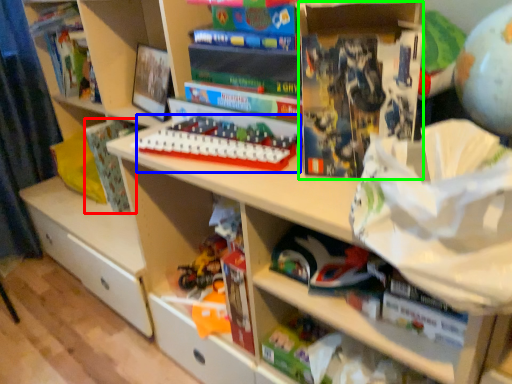
Question: Based on their relative distances, which object is farther from paperback book (highlighted by a red box)? Choose from toy (highlighted by a blue box) and paperback book (highlighted by a green box).

Choices:
 (A) toy
 (B) paperback book

Answer: (B)